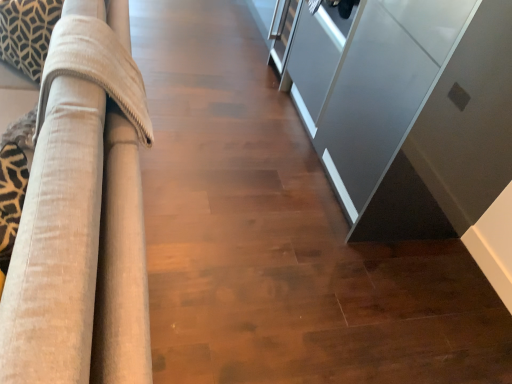
Where is `free space that is to the left of satin gray cabinet at right`? This screenshot has width=512, height=384. free space that is to the left of satin gray cabinet at right is located at coordinates (254, 169).